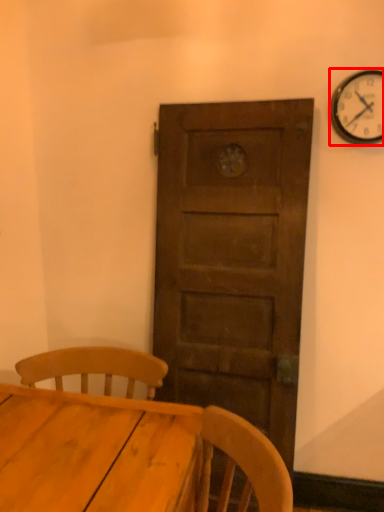
Question: From the image's perspective, where is wall clock (annotated by the red box) located relative to table?

Choices:
 (A) below
 (B) above

Answer: (B)